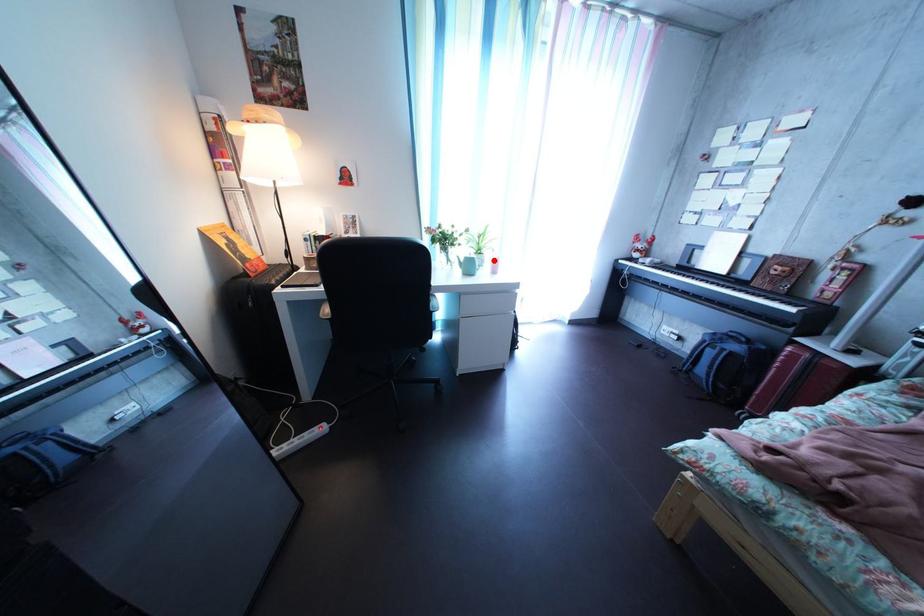
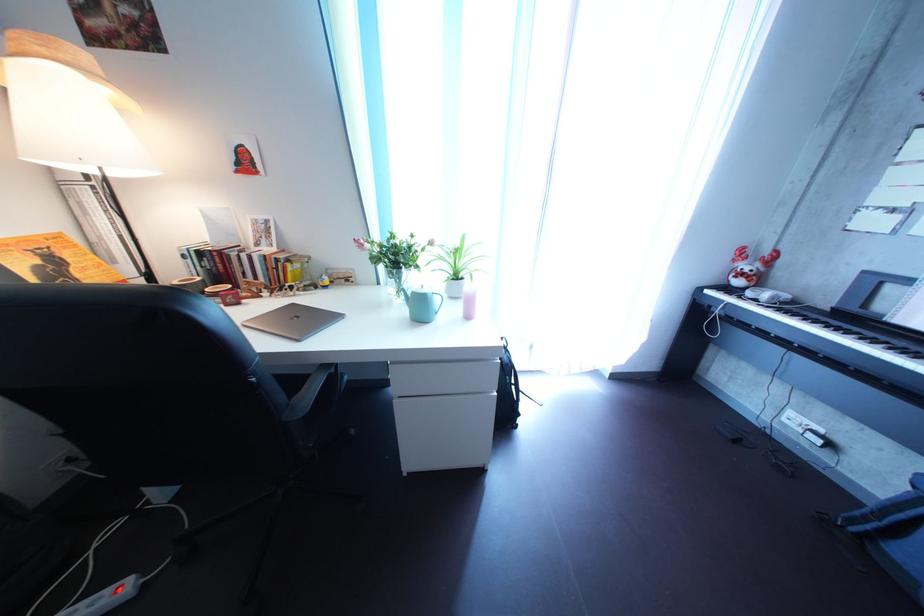
Question: I am providing you with two images of the same scene from different viewpoints. A red point is marked on the first image. Can you still see the location of the red point in image 2?

Choices:
 (A) Yes
 (B) No

Answer: (A)